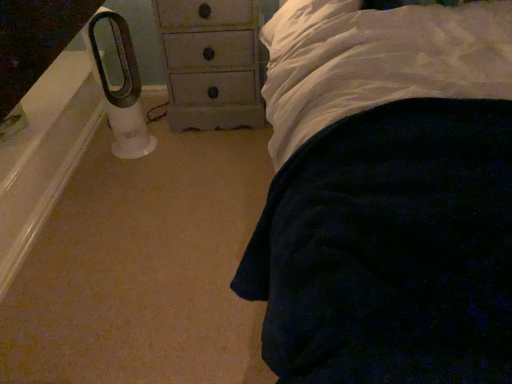
Identify the location of distressed wood chest of drawers at center. This screenshot has width=512, height=384. (211, 63).

Image resolution: width=512 pixels, height=384 pixels. Describe the element at coordinates (211, 63) in the screenshot. I see `distressed wood chest of drawers at center` at that location.

Find the location of `distressed wood chest of drawers at center`. distressed wood chest of drawers at center is located at coordinates (211, 63).